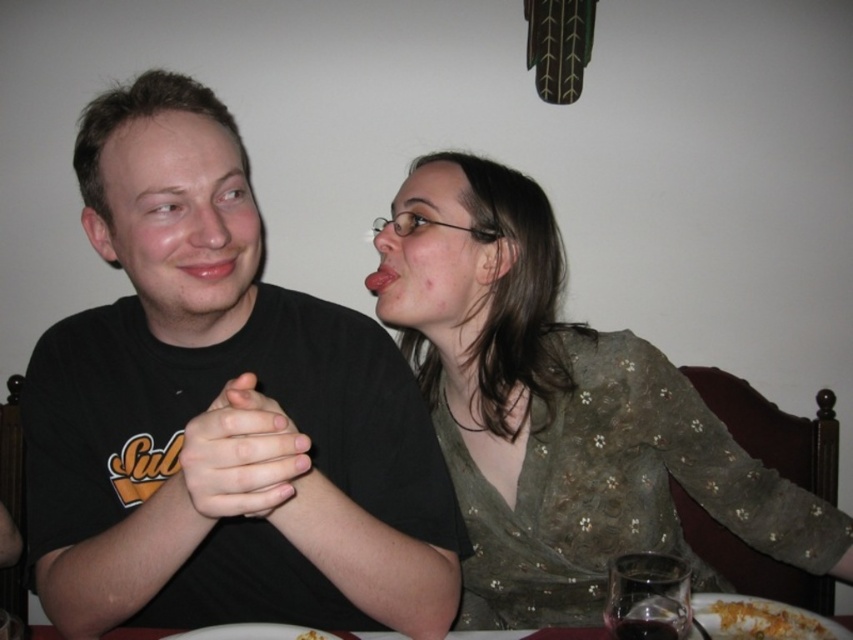
How much distance is there between black matte shirt at center and yellowish matte pasta at lower center?

black matte shirt at center is 10.61 inches away from yellowish matte pasta at lower center.

Does black matte shirt at center have a greater height compared to yellowish matte pasta at lower center?

Yes.

Locate an element on the screen. The width and height of the screenshot is (853, 640). black matte shirt at center is located at coordinates (221, 412).

Between green textured blouse at center and yellowish matte pasta at lower center, which one has more height?

green textured blouse at center is taller.

Which is above, green textured blouse at center or yellowish matte pasta at lower center?

green textured blouse at center

Locate an element on the screen. This screenshot has height=640, width=853. green textured blouse at center is located at coordinates (560, 410).

Is point (239, 436) closer to viewer compared to point (759, 608)?

Yes, point (239, 436) is in front of point (759, 608).

Between point (256, 412) and point (788, 608), which one is positioned in front?

Positioned in front is point (256, 412).

In order to click on matte black hands at center in this screenshot , I will do `click(239, 456)`.